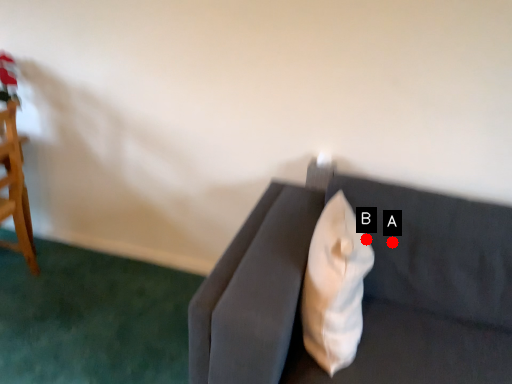
Question: Two points are circled on the image, labeled by A and B beside each circle. Which point is farther from the camera taking this photo?

Choices:
 (A) A is further
 (B) B is further

Answer: (A)